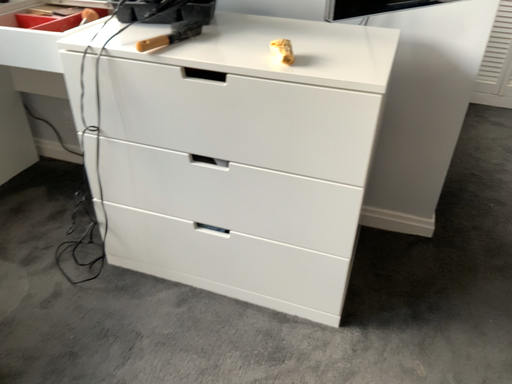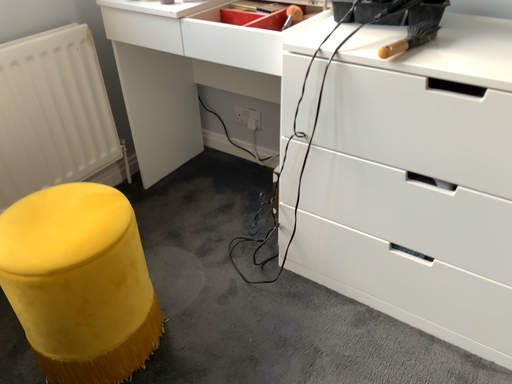
Question: Which way did the camera rotate in the video?

Choices:
 (A) rotated right
 (B) rotated left

Answer: (B)